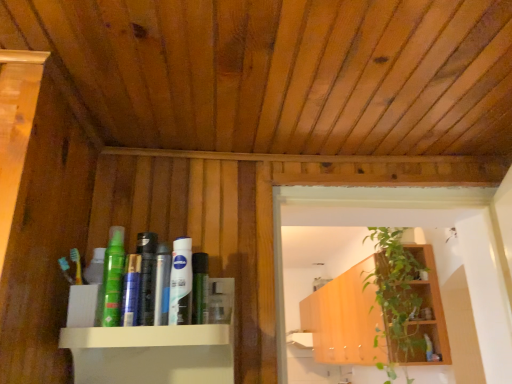
Question: From a real-world perspective, is blue matte toothpaste at center located higher than silver metallic can at center, the fifth toiletry viewed from the right?

Choices:
 (A) no
 (B) yes

Answer: (A)

Question: Is blue matte toothpaste at center further to camera compared to silver metallic can at center, the fifth toiletry viewed from the right?

Choices:
 (A) no
 (B) yes

Answer: (A)

Question: Is blue matte toothpaste at center not inside silver metallic can at center, the 5th toiletry positioned from the back?

Choices:
 (A) no
 (B) yes

Answer: (B)

Question: From a real-world perspective, does blue matte toothpaste at center sit lower than silver metallic can at center, which is the 3th toiletry from left to right?

Choices:
 (A) no
 (B) yes

Answer: (B)

Question: Is blue matte toothpaste at center bigger than silver metallic can at center, which appears as the third toiletry when viewed from the front?

Choices:
 (A) no
 (B) yes

Answer: (A)

Question: Is point (181, 294) positioned closer to the camera than point (163, 264)?

Choices:
 (A) closer
 (B) farther

Answer: (A)

Question: In the image, is white glossy lotion at center, which ranks as the 4th toiletry in left-to-right order, positioned in front of or behind silver metallic can at center, which is the 3th toiletry from left to right?

Choices:
 (A) front
 (B) behind

Answer: (A)

Question: From the image's perspective, is white glossy lotion at center, which is the fourth toiletry from right to left, above or below silver metallic can at center, which is the 3th toiletry from left to right?

Choices:
 (A) above
 (B) below

Answer: (A)

Question: In terms of height, does white glossy lotion at center, which is the fourth toiletry from right to left, look taller or shorter compared to silver metallic can at center, which is the 3th toiletry from left to right?

Choices:
 (A) tall
 (B) short

Answer: (A)

Question: In the image, is green leafy plant at upper right positioned in front of or behind white glossy lotion at center, which is the fourth toiletry from right to left?

Choices:
 (A) front
 (B) behind

Answer: (B)

Question: Is point (415, 279) positioned closer to the camera than point (180, 276)?

Choices:
 (A) closer
 (B) farther

Answer: (B)

Question: Is green leafy plant at upper right inside or outside of white glossy lotion at center, marked as the sixth toiletry in a back-to-front arrangement?

Choices:
 (A) inside
 (B) outside

Answer: (B)

Question: In terms of height, does green leafy plant at upper right look taller or shorter compared to white glossy lotion at center, which is the fourth toiletry from right to left?

Choices:
 (A) tall
 (B) short

Answer: (A)

Question: Considering their positions, is white glossy lotion at center, marked as the sixth toiletry in a back-to-front arrangement, located in front of or behind clear plastic bottle at center, the sixth toiletry positioned from the left?

Choices:
 (A) front
 (B) behind

Answer: (A)

Question: Visually, is white glossy lotion at center, which ranks as the 4th toiletry in left-to-right order, positioned to the left or to the right of clear plastic bottle at center, the second toiletry in the right-to-left sequence?

Choices:
 (A) right
 (B) left

Answer: (B)